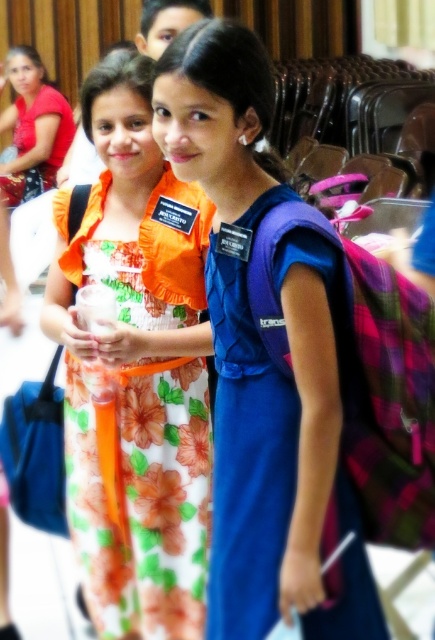
Question: Does floral dress at center come in front of matte red dress at upper left?

Choices:
 (A) yes
 (B) no

Answer: (A)

Question: Is purple fabric backpack at center bigger than matte red dress at upper left?

Choices:
 (A) yes
 (B) no

Answer: (B)

Question: Does floral dress at center appear under purple fabric backpack at center?

Choices:
 (A) no
 (B) yes

Answer: (A)

Question: Which point is farther to the camera?

Choices:
 (A) purple fabric backpack at center
 (B) floral dress at center

Answer: (B)

Question: Which is farther from the purple fabric backpack at center?

Choices:
 (A) floral dress at center
 (B) matte red dress at upper left

Answer: (B)

Question: Which object is the closest to the purple fabric backpack at center?

Choices:
 (A) floral dress at center
 (B) matte red dress at upper left

Answer: (A)